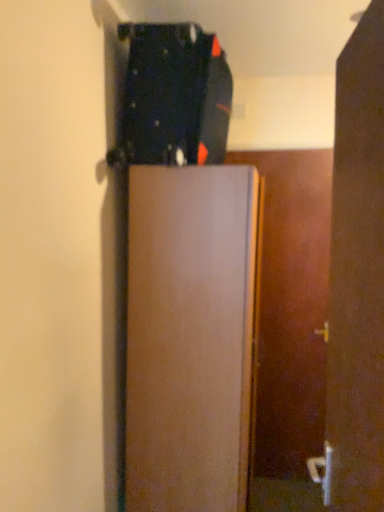
Find the location of a particular element. dark blue fabric at upper center is located at coordinates (173, 97).

Describe the element at coordinates (173, 97) in the screenshot. I see `dark blue fabric at upper center` at that location.

Locate an element on the screen. This screenshot has height=512, width=384. dark blue fabric at upper center is located at coordinates (173, 97).